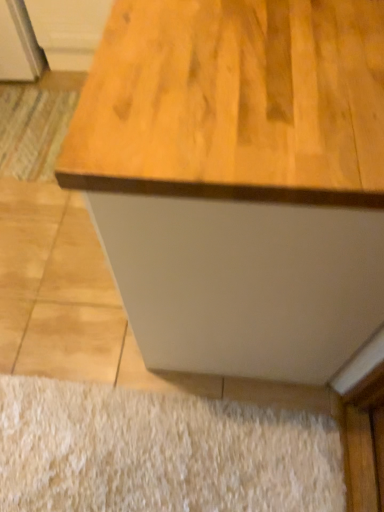
Question: Considering the relative positions of white shaggy rug at lower center, which is the second doormat from back to front, and striped fabric doormat at lower left, acting as the second doormat starting from the front, in the image provided, is white shaggy rug at lower center, which is the second doormat from back to front, to the left or to the right of striped fabric doormat at lower left, acting as the second doormat starting from the front,?

Choices:
 (A) left
 (B) right

Answer: (B)

Question: Looking at the image, does white shaggy rug at lower center, acting as the first doormat starting from the right, seem bigger or smaller compared to striped fabric doormat at lower left, marked as the 1th doormat in a back-to-front arrangement?

Choices:
 (A) big
 (B) small

Answer: (A)

Question: Estimate the real-world distances between objects in this image. Which object is farther from the wooden cabinet at upper left?

Choices:
 (A) white shaggy rug at lower center, arranged as the second doormat when viewed from the left
 (B) striped fabric doormat at lower left, arranged as the 2th doormat when viewed from the right

Answer: (A)

Question: Estimate the real-world distances between objects in this image. Which object is farther from the wooden cabinet at upper left?

Choices:
 (A) white shaggy rug at lower center, arranged as the 1th doormat when ordered from the bottom
 (B) striped fabric doormat at lower left, marked as the 1th doormat in a back-to-front arrangement

Answer: (A)